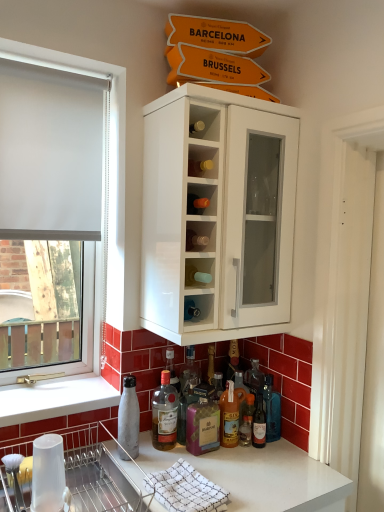
Where is `purple glass bottle at center, which ranks as the 2th bottle in left-to-right order`? Image resolution: width=384 pixels, height=512 pixels. purple glass bottle at center, which ranks as the 2th bottle in left-to-right order is located at coordinates coord(203,422).

The width and height of the screenshot is (384, 512). What do you see at coordinates (351, 302) in the screenshot?
I see `white wood screen door at right` at bounding box center [351, 302].

The image size is (384, 512). Describe the element at coordinates (247, 421) in the screenshot. I see `translucent glass bottle at lower center, which is the third bottle in right-to-left order` at that location.

Find the location of a particular element. translucent glass bottle at lower center is located at coordinates (x=164, y=414).

Which of these two, purple glass bottle at center, positioned as the 5th bottle in right-to-left order, or translucent glass bottle at lower center, is bigger?

Bigger between the two is translucent glass bottle at lower center.

How many degrees apart are the facing directions of purple glass bottle at center, which ranks as the 2th bottle in left-to-right order, and translucent glass bottle at lower center?

purple glass bottle at center, which ranks as the 2th bottle in left-to-right order, and translucent glass bottle at lower center are facing 0.000863 degrees away from each other.

Is purple glass bottle at center, positioned as the 5th bottle in right-to-left order, further to camera compared to translucent glass bottle at lower center?

No.

Is purple glass bottle at center, which ranks as the 2th bottle in left-to-right order, aimed at translucent glass bottle at lower center?

No, purple glass bottle at center, which ranks as the 2th bottle in left-to-right order, does not turn towards translucent glass bottle at lower center.

Considering the sizes of objects white matte window at left and transparent plastic cup at lower left in the image provided, who is shorter, white matte window at left or transparent plastic cup at lower left?

transparent plastic cup at lower left is shorter.

Does white matte window at left have a smaller size compared to transparent plastic cup at lower left?

No, white matte window at left is not smaller than transparent plastic cup at lower left.

From the image's perspective, is white matte window at left positioned above or below transparent plastic cup at lower left?

Based on their image positions, white matte window at left is located above transparent plastic cup at lower left.

Does white matte window at left touch transparent plastic cup at lower left?

No, white matte window at left is not touching transparent plastic cup at lower left.

From a real-world perspective, is transparent plastic cup at lower left on translucent glass bottle at lower center?

No, from a real-world perspective, transparent plastic cup at lower left is not over translucent glass bottle at lower center

Is transparent plastic cup at lower left far away from translucent glass bottle at lower center?

No.

Does transparent plastic cup at lower left have a lesser height compared to translucent glass bottle at lower center?

Yes, transparent plastic cup at lower left is shorter than translucent glass bottle at lower center.

Which object is closer to the camera, transparent plastic cup at lower left or translucent glass bottle at lower center?

transparent plastic cup at lower left is more forward.

Is metallic silver bottle at lower left, the first bottle from the left, looking in the opposite direction of white glossy cabinet at upper center?

No, metallic silver bottle at lower left, the first bottle from the left,'s orientation is not away from white glossy cabinet at upper center.

Based on their positions, is metallic silver bottle at lower left, the sixth bottle positioned from the right, located to the left or right of white glossy cabinet at upper center?

metallic silver bottle at lower left, the sixth bottle positioned from the right, is to the left of white glossy cabinet at upper center.

In terms of height, does metallic silver bottle at lower left, the first bottle from the left, look taller or shorter compared to white glossy cabinet at upper center?

Clearly, metallic silver bottle at lower left, the first bottle from the left, is shorter compared to white glossy cabinet at upper center.

Is translucent glass bottle at lower center inside translucent glass bottle at lower center, which is the third bottle in right-to-left order?

No, translucent glass bottle at lower center is located outside of translucent glass bottle at lower center, which is the third bottle in right-to-left order.

In terms of size, does translucent glass bottle at lower center, which is the third bottle in right-to-left order, appear bigger or smaller than translucent glass bottle at lower center?

translucent glass bottle at lower center, which is the third bottle in right-to-left order, is smaller than translucent glass bottle at lower center.

Is translucent glass bottle at lower center, which is the 4th bottle in left-to-right order, positioned before translucent glass bottle at lower center?

No, translucent glass bottle at lower center, which is the 4th bottle in left-to-right order, is further to the viewer.

From the image's perspective, between translucent glass bottle at lower center, which is the third bottle in right-to-left order, and translucent glass bottle at lower center, who is located below?

translucent glass bottle at lower center, which is the third bottle in right-to-left order.

Is translucent glass bottle at lower center, the sixth bottle when ordered from left to right, at the back of white wood screen door at right?

No.

How distant is white wood screen door at right from translucent glass bottle at lower center, which is the 1th bottle from right to left?

white wood screen door at right is 16.66 inches from translucent glass bottle at lower center, which is the 1th bottle from right to left.

Is the depth of white wood screen door at right greater than that of translucent glass bottle at lower center, the sixth bottle when ordered from left to right?

No, it is not.

Considering the relative sizes of white wood screen door at right and translucent glass bottle at lower center, the sixth bottle when ordered from left to right, in the image provided, is white wood screen door at right taller than translucent glass bottle at lower center, the sixth bottle when ordered from left to right,?

Correct, white wood screen door at right is much taller as translucent glass bottle at lower center, the sixth bottle when ordered from left to right.

Measure the distance between purple glass bottle at center, positioned as the 5th bottle in right-to-left order, and metallic silver dish rack at lower left.

purple glass bottle at center, positioned as the 5th bottle in right-to-left order, and metallic silver dish rack at lower left are 33.36 centimeters apart.

Is point (201, 421) closer to camera compared to point (98, 426)?

Yes, it is in front of point (98, 426).

Is purple glass bottle at center, positioned as the 5th bottle in right-to-left order, at the right side of metallic silver dish rack at lower left?

Yes, purple glass bottle at center, positioned as the 5th bottle in right-to-left order, is to the right of metallic silver dish rack at lower left.

Is purple glass bottle at center, positioned as the 5th bottle in right-to-left order, facing towards metallic silver dish rack at lower left?

No, purple glass bottle at center, positioned as the 5th bottle in right-to-left order, is not facing towards metallic silver dish rack at lower left.

The width and height of the screenshot is (384, 512). I want to click on beverage behind the purple glass bottle at center, positioned as the 5th bottle in right-to-left order, so click(164, 414).

Where is `window positioned vertically above the transparent plastic cup at lower left (from a real-world perspective)`? The width and height of the screenshot is (384, 512). window positioned vertically above the transparent plastic cup at lower left (from a real-world perspective) is located at coordinates (84, 256).

Considering their positions, is white wood screen door at right positioned further to white glossy cabinet at upper center than translucent glass bottle at lower center?

translucent glass bottle at lower center lies further to white glossy cabinet at upper center than the other object.

Which object lies further to the anchor point translucent glass bottle at lower center, translucent glass bottle at lower center, which is the 4th bottle from right to left, or metallic silver dish rack at lower left?

metallic silver dish rack at lower left lies further to translucent glass bottle at lower center than the other object.

When comparing their distances from translucent glass bottle at lower center, which is the 1th bottle from right to left, does translucent glass bottle at lower center, the fifth bottle positioned from the left, or translucent glass bottle at lower center, which is the 3th bottle in left-to-right order, seem closer?

Result: The object closer to translucent glass bottle at lower center, which is the 1th bottle from right to left, is translucent glass bottle at lower center, the fifth bottle positioned from the left.

Looking at the image, which one is located further to purple glass bottle at center, which ranks as the 2th bottle in left-to-right order, metallic silver dish rack at lower left or translucent glass bottle at lower center, which is the 3th bottle in left-to-right order?

Based on the image, metallic silver dish rack at lower left appears to be further to purple glass bottle at center, which ranks as the 2th bottle in left-to-right order.

Which object lies nearer to the anchor point white matte window at left, purple glass bottle at center, positioned as the 5th bottle in right-to-left order, or translucent glass bottle at lower center, the sixth bottle when ordered from left to right?

purple glass bottle at center, positioned as the 5th bottle in right-to-left order, lies closer to white matte window at left than the other object.

Which object lies further to the anchor point white glossy cabinet at upper center, metallic silver bottle at lower left, the first bottle from the left, or translucent glass bottle at lower center, the sixth bottle when ordered from left to right?

metallic silver bottle at lower left, the first bottle from the left, lies further to white glossy cabinet at upper center than the other object.

Which object lies further to the anchor point white glossy cabinet at upper center, translucent glass bottle at lower center or translucent glass bottle at lower center, which is the 1th bottle from right to left?

translucent glass bottle at lower center, which is the 1th bottle from right to left, is positioned further to the anchor white glossy cabinet at upper center.

Considering their positions, is metallic silver bottle at lower left, the first bottle from the left, positioned further to transparent plastic cup at lower left than translucent glass bottle at lower center?

Based on the image, translucent glass bottle at lower center appears to be further to transparent plastic cup at lower left.

This screenshot has width=384, height=512. Identify the location of appliance between white glossy cabinet at upper center and translucent glass bottle at lower center, the fifth bottle positioned from the left, in the vertical direction. (48, 474).

Find the location of a particular element. This screenshot has width=384, height=512. dish washer between transparent plastic cup at lower left and white wood screen door at right in the horizontal direction is located at coordinates (101, 471).

You are a GUI agent. You are given a task and a screenshot of the screen. Output one action in this format:
    pyautogui.click(x=<x>, y=<y>)
    Task: Click on the bottle between white glossy cabinet at upper center and translucent glass bottle at lower center vertically
    Image resolution: width=384 pixels, height=512 pixels.
    Given the screenshot: What is the action you would take?
    pyautogui.click(x=129, y=417)

Locate an element on the screen. Image resolution: width=384 pixels, height=512 pixels. screen door between white glossy cabinet at upper center and translucent glass bottle at lower center, the sixth bottle when ordered from left to right, vertically is located at coordinates (351, 302).